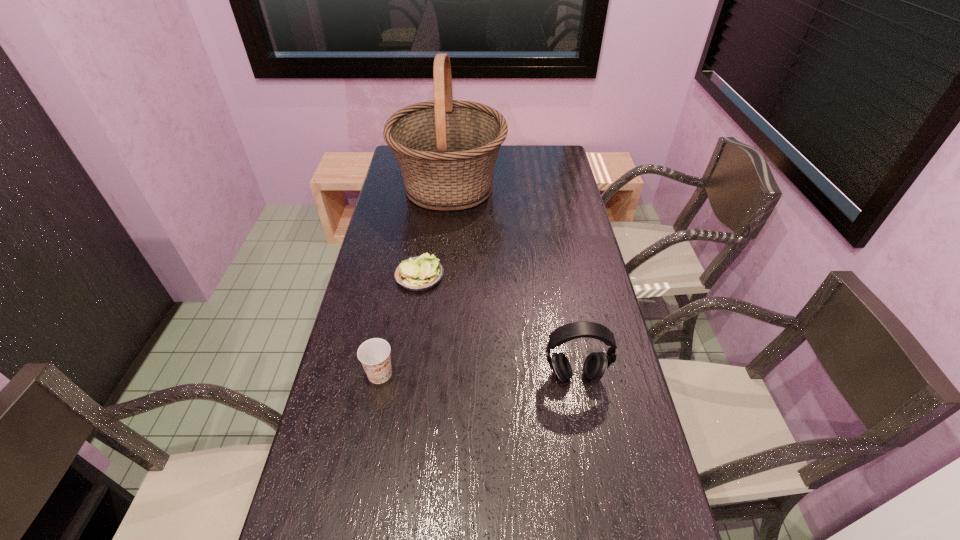
Where is `vacant area between the basket and the lettuce`? This screenshot has height=540, width=960. vacant area between the basket and the lettuce is located at coordinates (435, 231).

Find the location of a particular element. This screenshot has height=540, width=960. empty location between the lettuce and the basket is located at coordinates (435, 231).

Identify the location of free spot between the farthest object and the rightmost object. The image size is (960, 540). (512, 281).

Where is `unoccupied area between the earphone and the farthest object`? This screenshot has height=540, width=960. unoccupied area between the earphone and the farthest object is located at coordinates (512, 281).

The width and height of the screenshot is (960, 540). Find the location of `unoccupied area between the farthest object and the second farthest object`. unoccupied area between the farthest object and the second farthest object is located at coordinates (435, 231).

Find the location of a particular element. The image size is (960, 540). vacant space that's between the farthest object and the shortest object is located at coordinates (435, 231).

What are the coordinates of `blank region between the second farthest object and the earphone` in the screenshot? It's located at (497, 326).

You are a GUI agent. You are given a task and a screenshot of the screen. Output one action in this format:
    pyautogui.click(x=<x>, y=<y>)
    Task: Click on the vacant area that lies between the third tallest object and the earphone
    
    Given the screenshot: What is the action you would take?
    pyautogui.click(x=477, y=375)

You are a GUI agent. You are given a task and a screenshot of the screen. Output one action in this format:
    pyautogui.click(x=<x>, y=<y>)
    Task: Click on the vacant space that's between the earphone and the Dixie cup
    The width and height of the screenshot is (960, 540).
    Given the screenshot: What is the action you would take?
    pyautogui.click(x=477, y=375)

Point out which object is positioned as the nearest to the farthest object. Please provide its 2D coordinates. Your answer should be formatted as a tuple, i.e. [(x, y)], where the tuple contains the x and y coordinates of a point satisfying the conditions above.

[(419, 273)]